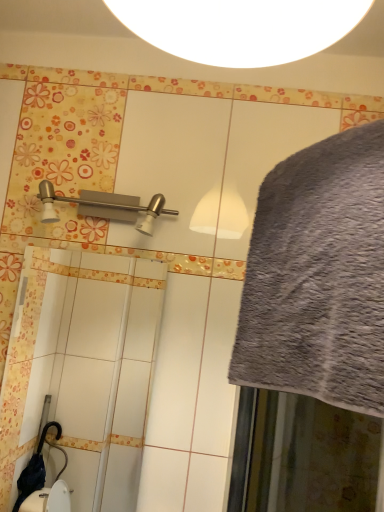
Question: Considering their positions, is satin nickel shower at upper left located in front of or behind gray fluffy bath towel at right?

Choices:
 (A) front
 (B) behind

Answer: (B)

Question: From the image's perspective, is satin nickel shower at upper left above or below gray fluffy bath towel at right?

Choices:
 (A) above
 (B) below

Answer: (A)

Question: Considering the positions of satin nickel shower at upper left and gray fluffy bath towel at right in the image, is satin nickel shower at upper left wider or thinner than gray fluffy bath towel at right?

Choices:
 (A) wide
 (B) thin

Answer: (B)

Question: Would you say gray fluffy bath towel at right is to the left or to the right of satin nickel shower at upper left in the picture?

Choices:
 (A) right
 (B) left

Answer: (A)

Question: Considering the positions of gray fluffy bath towel at right and satin nickel shower at upper left in the image, is gray fluffy bath towel at right taller or shorter than satin nickel shower at upper left?

Choices:
 (A) tall
 (B) short

Answer: (A)

Question: In terms of size, does gray fluffy bath towel at right appear bigger or smaller than satin nickel shower at upper left?

Choices:
 (A) small
 (B) big

Answer: (B)

Question: From the image's perspective, is gray fluffy bath towel at right above or below satin nickel shower at upper left?

Choices:
 (A) below
 (B) above

Answer: (A)